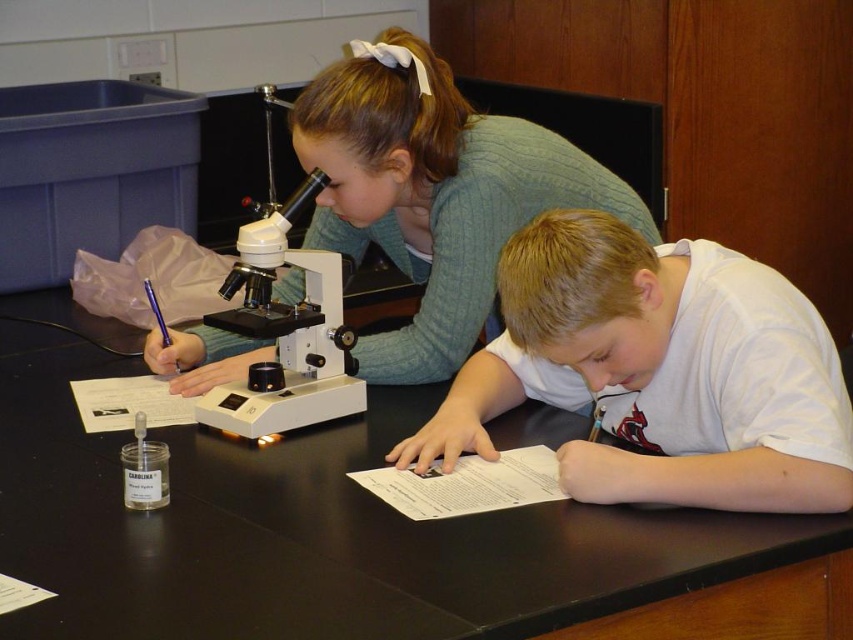
Who is more forward, (701, 486) or (550, 202)?

Point (701, 486) is in front.

Which is in front, point (759, 468) or point (554, 205)?

Positioned in front is point (759, 468).

Where is `white matte shirt at center`? The height and width of the screenshot is (640, 853). white matte shirt at center is located at coordinates (657, 372).

Between white matte shirt at center and white plastic microscope at center, which one appears on the right side from the viewer's perspective?

From the viewer's perspective, white matte shirt at center appears more on the right side.

In the scene shown: Between white matte shirt at center and white plastic microscope at center, which one has less height?

Standing shorter between the two is white matte shirt at center.

Does point (689, 440) lie in front of point (308, 317)?

Yes, it is in front of point (308, 317).

This screenshot has width=853, height=640. I want to click on white matte shirt at center, so click(657, 372).

Does green sweater at upper center have a lesser width compared to white plastic microscope at center?

Incorrect, green sweater at upper center's width is not less than white plastic microscope at center's.

Is point (352, 241) farther from viewer compared to point (293, 216)?

Yes, it is behind point (293, 216).

Between point (469, 296) and point (334, 310), which one is positioned in front?

Point (334, 310)

Find the location of a particular element. This screenshot has height=640, width=853. green sweater at upper center is located at coordinates (433, 193).